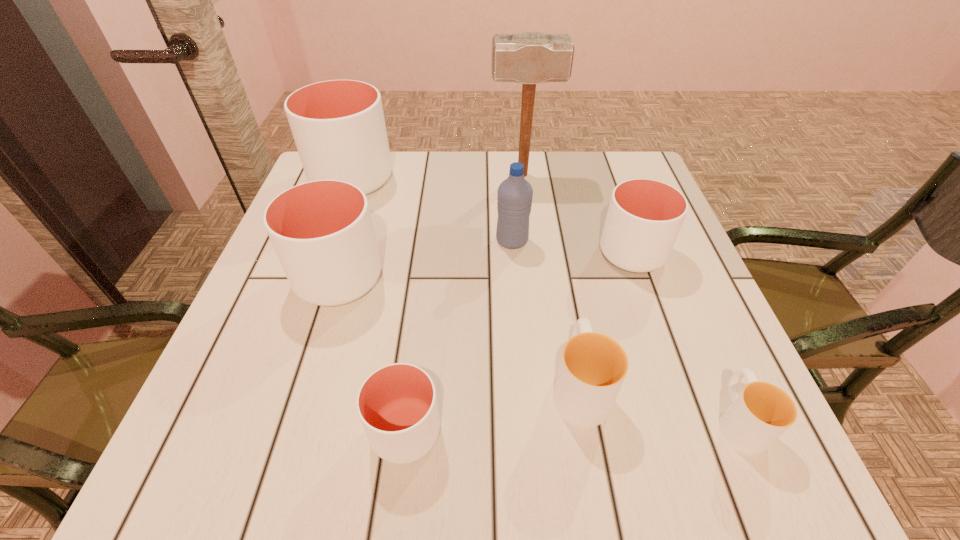
Where is `the nearest white cup`? The width and height of the screenshot is (960, 540). the nearest white cup is located at coordinates (397, 404).

Find the location of a particular element. the shortest object is located at coordinates (762, 412).

At what (x,y) coordinates should I click in order to perform the action: click on the smaller yellow cup. Please return your answer as a coordinate pair (x, y). The image size is (960, 540). Looking at the image, I should click on (762, 412).

The height and width of the screenshot is (540, 960). Identify the location of vacant space situated 0.350m on the striking face of the tallest object. (358, 175).

Where is `vacant space positioned on the striking face of the tallest object`? vacant space positioned on the striking face of the tallest object is located at coordinates (415, 175).

This screenshot has height=540, width=960. In order to click on free space located 0.070m on the striking face of the tallest object in this screenshot , I will do `click(464, 175)`.

The height and width of the screenshot is (540, 960). In order to click on free spot located on the front of the farthest cup in this screenshot , I will do `click(312, 291)`.

Where is `vacant space situated 0.090m on the right of the water bottle`? Image resolution: width=960 pixels, height=540 pixels. vacant space situated 0.090m on the right of the water bottle is located at coordinates (568, 241).

Where is `blank space located on the right of the third smallest white cup`? blank space located on the right of the third smallest white cup is located at coordinates (470, 278).

Locate an element on the screen. The height and width of the screenshot is (540, 960). free space located 0.400m on the left of the rightmost white cup is located at coordinates (415, 253).